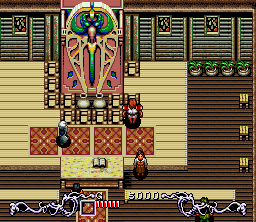
Identify the location of book. The image size is (256, 222). (97, 160).